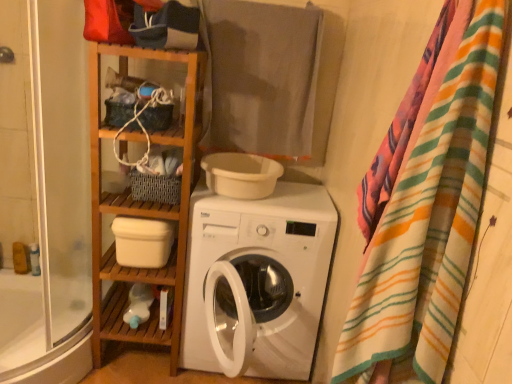
Question: Does wooden shelf at left, the first cabinet positioned from the bottom, have a lesser width compared to transparent glass shower door at left?

Choices:
 (A) yes
 (B) no

Answer: (A)

Question: Is wooden shelf at left, the first cabinet positioned from the bottom, bigger than transparent glass shower door at left?

Choices:
 (A) no
 (B) yes

Answer: (A)

Question: Could you tell me if wooden shelf at left, the first cabinet positioned from the bottom, is facing transparent glass shower door at left?

Choices:
 (A) yes
 (B) no

Answer: (B)

Question: Considering the relative sizes of wooden shelf at left, the first cabinet positioned from the bottom, and transparent glass shower door at left in the image provided, is wooden shelf at left, the first cabinet positioned from the bottom, shorter than transparent glass shower door at left?

Choices:
 (A) no
 (B) yes

Answer: (A)

Question: Are wooden shelf at left, marked as the 2th cabinet in a top-to-bottom arrangement, and transparent glass shower door at left making contact?

Choices:
 (A) no
 (B) yes

Answer: (A)

Question: Is wooden shelf at left, the first cabinet positioned from the bottom, oriented away from transparent glass shower door at left?

Choices:
 (A) no
 (B) yes

Answer: (A)

Question: From the image's perspective, would you say wooden shelf at left, the first cabinet positioned from the bottom, is shown under white glossy bathtub at lower left?

Choices:
 (A) no
 (B) yes

Answer: (A)

Question: Is wooden shelf at left, the first cabinet positioned from the bottom, taller than white glossy bathtub at lower left?

Choices:
 (A) yes
 (B) no

Answer: (A)

Question: Can you confirm if wooden shelf at left, marked as the 2th cabinet in a top-to-bottom arrangement, is positioned to the left of white glossy bathtub at lower left?

Choices:
 (A) yes
 (B) no

Answer: (B)

Question: From the image's perspective, is wooden shelf at left, marked as the 2th cabinet in a top-to-bottom arrangement, on top of white glossy bathtub at lower left?

Choices:
 (A) yes
 (B) no

Answer: (A)

Question: Can you confirm if wooden shelf at left, marked as the 2th cabinet in a top-to-bottom arrangement, is thinner than white glossy bathtub at lower left?

Choices:
 (A) no
 (B) yes

Answer: (B)

Question: From a real-world perspective, is wooden shelf at left, the first cabinet positioned from the bottom, under white glossy bathtub at lower left?

Choices:
 (A) yes
 (B) no

Answer: (B)

Question: Does gray cotton towel at upper center have a lesser width compared to transparent glass shower door at left?

Choices:
 (A) yes
 (B) no

Answer: (A)